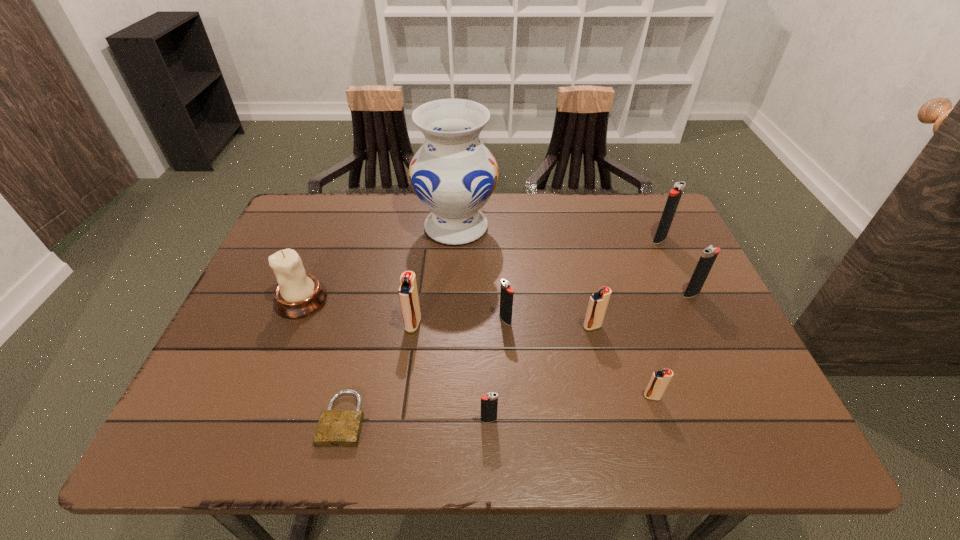
The height and width of the screenshot is (540, 960). I want to click on the second smallest black igniter, so click(x=506, y=293).

Identify the location of the second nearest black igniter. (506, 293).

You are a GUI agent. You are given a task and a screenshot of the screen. Output one action in this format:
    pyautogui.click(x=<x>, y=<y>)
    Task: Click on the second red igniter from right to left
    This screenshot has width=960, height=540.
    Given the screenshot: What is the action you would take?
    pyautogui.click(x=598, y=302)

I want to click on the fourth igniter from right to left, so click(598, 302).

Image resolution: width=960 pixels, height=540 pixels. What are the coordinates of `the second nearest igniter` in the screenshot? It's located at (659, 381).

Image resolution: width=960 pixels, height=540 pixels. What are the coordinates of `the rightmost red igniter` in the screenshot? It's located at (659, 381).

I want to click on the smallest black igniter, so click(489, 403).

Image resolution: width=960 pixels, height=540 pixels. I want to click on the nearest igniter, so click(489, 403).

Where is `the shortest object`? The image size is (960, 540). the shortest object is located at coordinates (336, 428).

Locate an element on the screen. Image resolution: width=960 pixels, height=540 pixels. padlock is located at coordinates (336, 428).